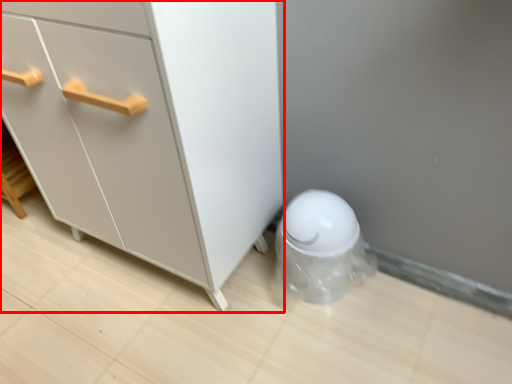
Question: Where is chest of drawers (annotated by the red box) located in relation to porcelain in the image?

Choices:
 (A) left
 (B) right

Answer: (A)